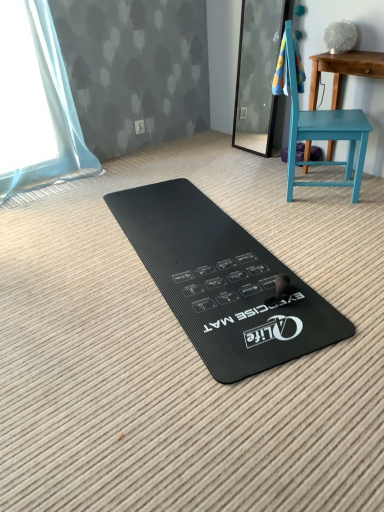
Question: Is black rubber exercise mat at center bigger than blue textured towel at upper right?

Choices:
 (A) yes
 (B) no

Answer: (A)

Question: Is black rubber exercise mat at center to the left of blue textured towel at upper right from the viewer's perspective?

Choices:
 (A) no
 (B) yes

Answer: (B)

Question: Can you confirm if black rubber exercise mat at center is thinner than blue textured towel at upper right?

Choices:
 (A) yes
 (B) no

Answer: (B)

Question: Can you confirm if black rubber exercise mat at center is wider than blue textured towel at upper right?

Choices:
 (A) yes
 (B) no

Answer: (A)

Question: From the image's perspective, would you say black rubber exercise mat at center is shown under blue textured towel at upper right?

Choices:
 (A) no
 (B) yes

Answer: (B)

Question: Is blue textured towel at upper right at the back of black rubber exercise mat at center?

Choices:
 (A) no
 (B) yes

Answer: (A)

Question: Is teal painted wood table at right behind teal matte chair at right?

Choices:
 (A) no
 (B) yes

Answer: (B)

Question: Does teal painted wood table at right have a greater height compared to teal matte chair at right?

Choices:
 (A) yes
 (B) no

Answer: (B)

Question: Can you confirm if teal painted wood table at right is smaller than teal matte chair at right?

Choices:
 (A) no
 (B) yes

Answer: (B)

Question: Can you confirm if teal painted wood table at right is bigger than teal matte chair at right?

Choices:
 (A) no
 (B) yes

Answer: (A)

Question: Does teal painted wood table at right have a greater width compared to teal matte chair at right?

Choices:
 (A) no
 (B) yes

Answer: (A)

Question: Can you confirm if teal painted wood table at right is positioned to the right of teal matte chair at right?

Choices:
 (A) no
 (B) yes

Answer: (B)

Question: Does teal painted wood table at right have a lesser width compared to blue textured towel at upper right?

Choices:
 (A) yes
 (B) no

Answer: (B)